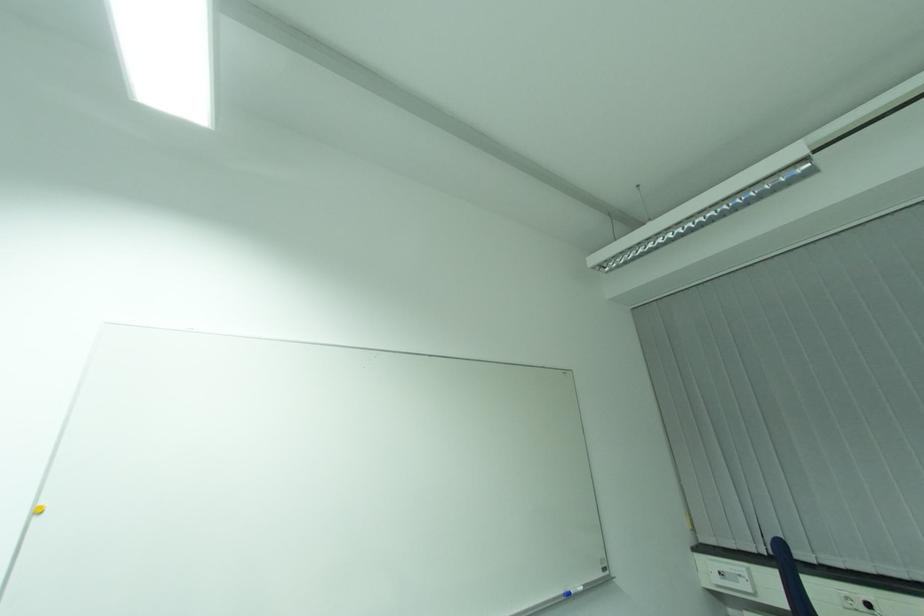
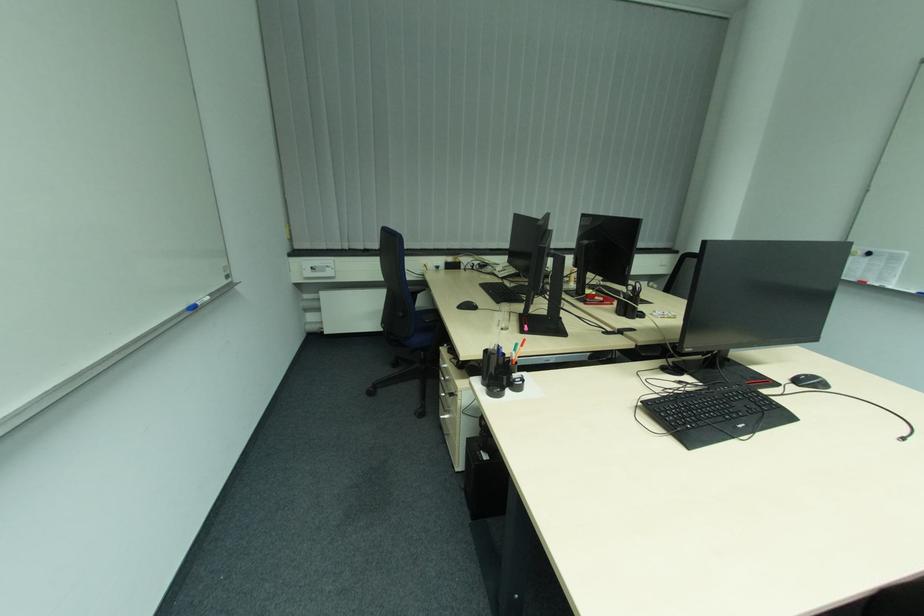
Consider the image. Based on the continuous images, in which direction is the camera rotating?

The camera rotated toward right-down.